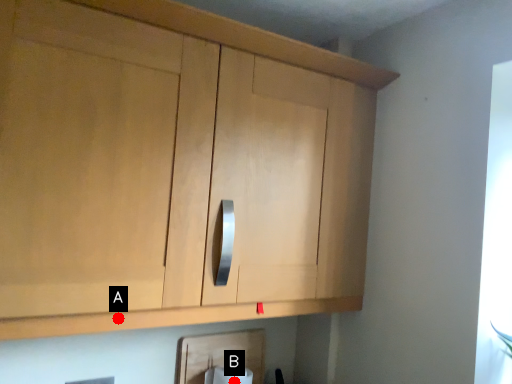
Question: Two points are circled on the image, labeled by A and B beside each circle. Which point appears closest to the camera in this image?

Choices:
 (A) A is closer
 (B) B is closer

Answer: (A)